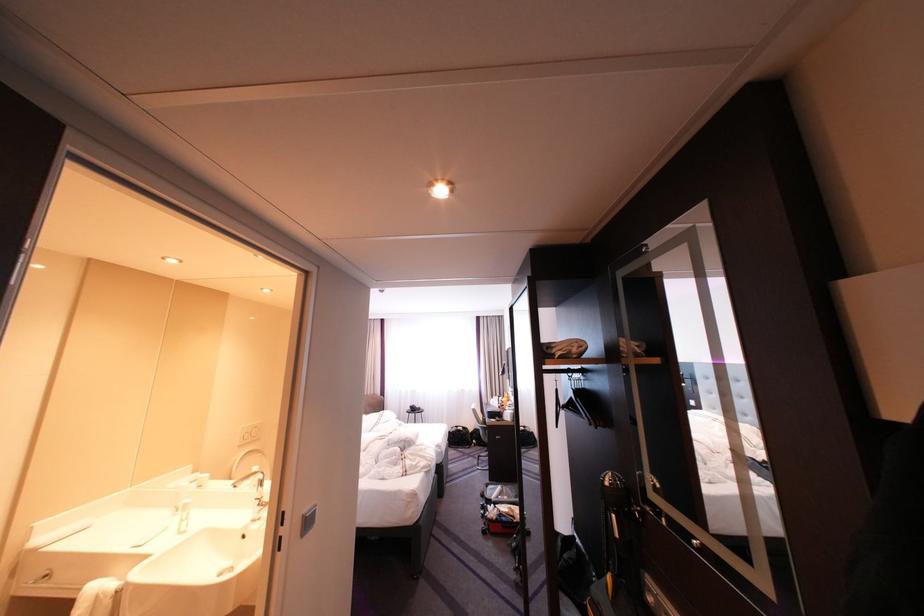
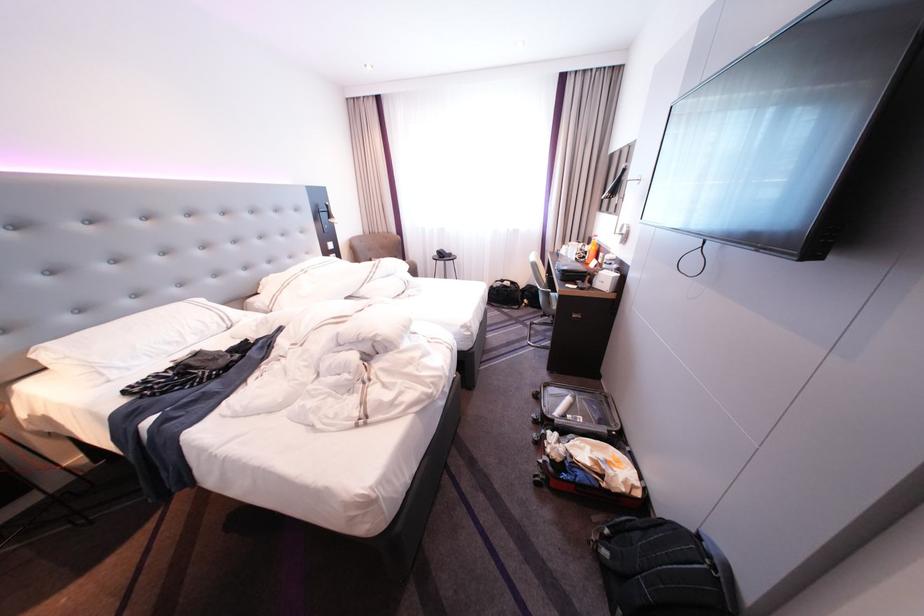
In the second image, find the point that corresponds to point (513, 399) in the first image.

(593, 245)